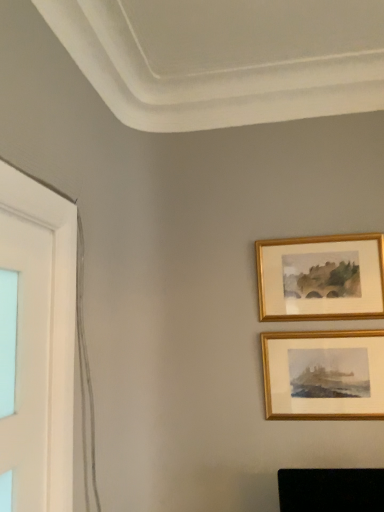
Question: Considering the relative sizes of gold/golden frame at upper right, the second picture frame from the top, and gold/golden frame at upper right, the 1th picture frame viewed from the top, in the image provided, is gold/golden frame at upper right, the second picture frame from the top, bigger than gold/golden frame at upper right, the 1th picture frame viewed from the top,?

Choices:
 (A) yes
 (B) no

Answer: (B)

Question: From the image's perspective, is gold/golden frame at upper right, which ranks as the first picture frame in bottom-to-top order, located above gold/golden frame at upper right, the 1th picture frame viewed from the top?

Choices:
 (A) yes
 (B) no

Answer: (B)

Question: From a real-world perspective, is gold/golden frame at upper right, the second picture frame from the top, on top of gold/golden frame at upper right, the 1th picture frame viewed from the top?

Choices:
 (A) yes
 (B) no

Answer: (B)

Question: Considering the relative positions of gold/golden frame at upper right, the second picture frame from the top, and gold/golden frame at upper right, the 2th picture frame when ordered from bottom to top, in the image provided, is gold/golden frame at upper right, the second picture frame from the top, to the right of gold/golden frame at upper right, the 2th picture frame when ordered from bottom to top, from the viewer's perspective?

Choices:
 (A) no
 (B) yes

Answer: (A)

Question: Is gold/golden frame at upper right, which ranks as the first picture frame in bottom-to-top order, aimed at gold/golden frame at upper right, the 2th picture frame when ordered from bottom to top?

Choices:
 (A) no
 (B) yes

Answer: (A)

Question: Is gold/golden frame at upper right, the second picture frame from the top, positioned with its back to gold/golden frame at upper right, the 1th picture frame viewed from the top?

Choices:
 (A) yes
 (B) no

Answer: (B)

Question: From a real-world perspective, is gold/golden frame at upper right, the 1th picture frame viewed from the top, under gold/golden frame at upper right, the second picture frame from the top?

Choices:
 (A) yes
 (B) no

Answer: (B)

Question: Can you confirm if gold/golden frame at upper right, the 2th picture frame when ordered from bottom to top, is shorter than gold/golden frame at upper right, the second picture frame from the top?

Choices:
 (A) no
 (B) yes

Answer: (B)

Question: Could you tell me if gold/golden frame at upper right, the 2th picture frame when ordered from bottom to top, is facing gold/golden frame at upper right, which ranks as the first picture frame in bottom-to-top order?

Choices:
 (A) no
 (B) yes

Answer: (A)

Question: Does gold/golden frame at upper right, the 2th picture frame when ordered from bottom to top, contain gold/golden frame at upper right, which ranks as the first picture frame in bottom-to-top order?

Choices:
 (A) no
 (B) yes

Answer: (A)

Question: Is gold/golden frame at upper right, the 2th picture frame when ordered from bottom to top, located outside gold/golden frame at upper right, the second picture frame from the top?

Choices:
 (A) yes
 (B) no

Answer: (A)

Question: From the image's perspective, is gold/golden frame at upper right, the 1th picture frame viewed from the top, beneath gold/golden frame at upper right, which ranks as the first picture frame in bottom-to-top order?

Choices:
 (A) yes
 (B) no

Answer: (B)

Question: Is gold/golden frame at upper right, the 1th picture frame viewed from the top, wider or thinner than gold/golden frame at upper right, which ranks as the first picture frame in bottom-to-top order?

Choices:
 (A) wide
 (B) thin

Answer: (A)